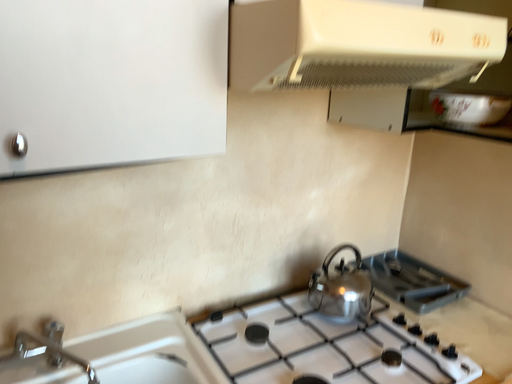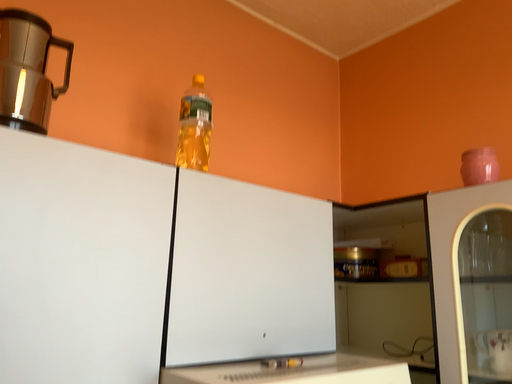
Question: How did the camera likely rotate when shooting the video?

Choices:
 (A) rotated left
 (B) rotated right

Answer: (B)